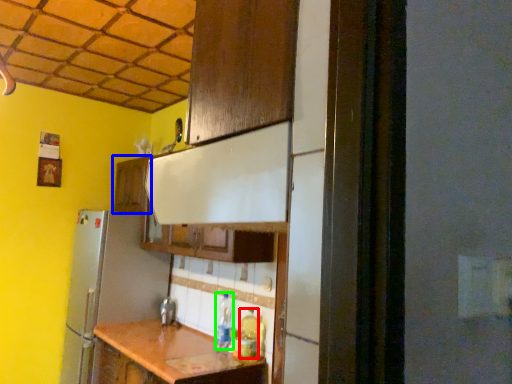
Question: Which is nearer to the bottle (highlighted by a red box)? cabinetry (highlighted by a blue box) or bottle (highlighted by a green box).

Choices:
 (A) cabinetry
 (B) bottle

Answer: (B)